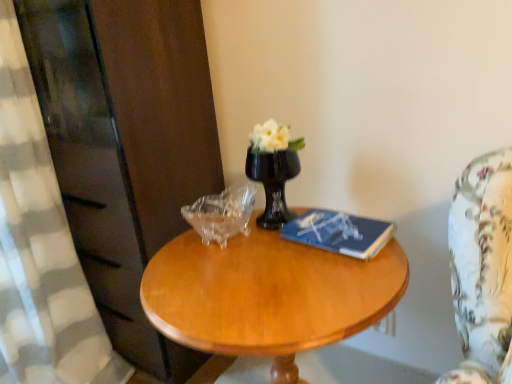
Question: Is light brown wood coffee table at center looking in the opposite direction of black glass vase at center?

Choices:
 (A) yes
 (B) no

Answer: (B)

Question: From a real-world perspective, is light brown wood coffee table at center below black glass vase at center?

Choices:
 (A) yes
 (B) no

Answer: (A)

Question: Could you tell me if light brown wood coffee table at center is turned towards black glass vase at center?

Choices:
 (A) no
 (B) yes

Answer: (A)

Question: Is light brown wood coffee table at center closer to the viewer compared to black glass vase at center?

Choices:
 (A) no
 (B) yes

Answer: (B)

Question: Is light brown wood coffee table at center smaller than black glass vase at center?

Choices:
 (A) no
 (B) yes

Answer: (A)

Question: Is transparent glass piggy bank at center to the left or to the right of black glass vase at center in the image?

Choices:
 (A) left
 (B) right

Answer: (A)

Question: Choose the correct answer: Is transparent glass piggy bank at center inside black glass vase at center or outside it?

Choices:
 (A) outside
 (B) inside

Answer: (A)

Question: Is transparent glass piggy bank at center wider or thinner than black glass vase at center?

Choices:
 (A) thin
 (B) wide

Answer: (B)

Question: Considering their positions, is transparent glass piggy bank at center located in front of or behind black glass vase at center?

Choices:
 (A) behind
 (B) front

Answer: (B)

Question: Is transparent glass piggy bank at center situated inside light brown wood coffee table at center or outside?

Choices:
 (A) inside
 (B) outside

Answer: (B)

Question: From a real-world perspective, is transparent glass piggy bank at center physically located above or below light brown wood coffee table at center?

Choices:
 (A) above
 (B) below

Answer: (A)

Question: From the image's perspective, relative to light brown wood coffee table at center, is transparent glass piggy bank at center above or below?

Choices:
 (A) below
 (B) above

Answer: (B)

Question: Is transparent glass piggy bank at center in front of or behind light brown wood coffee table at center in the image?

Choices:
 (A) behind
 (B) front

Answer: (A)

Question: Is blue matte book at center inside or outside of light brown wood coffee table at center?

Choices:
 (A) outside
 (B) inside

Answer: (B)

Question: From a real-world perspective, is blue matte book at center physically located above or below light brown wood coffee table at center?

Choices:
 (A) below
 (B) above

Answer: (B)